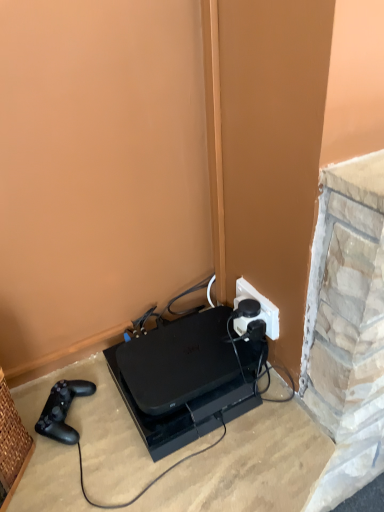
Question: From a real-world perspective, does white plastic power plugs and sockets at center-right sit lower than black matte game controller at lower left?

Choices:
 (A) yes
 (B) no

Answer: (B)

Question: From a real-world perspective, is white plastic power plugs and sockets at center-right physically above black matte game controller at lower left?

Choices:
 (A) yes
 (B) no

Answer: (A)

Question: Does white plastic power plugs and sockets at center-right appear on the right side of black matte game controller at lower left?

Choices:
 (A) no
 (B) yes

Answer: (B)

Question: Does white plastic power plugs and sockets at center-right turn towards black matte game controller at lower left?

Choices:
 (A) yes
 (B) no

Answer: (A)

Question: Is white plastic power plugs and sockets at center-right oriented away from black matte game controller at lower left?

Choices:
 (A) yes
 (B) no

Answer: (B)

Question: Is white plastic power plugs and sockets at center-right touching black matte game controller at lower left?

Choices:
 (A) yes
 (B) no

Answer: (B)

Question: Does black matte game controller at lower left lie in front of white plastic power plugs and sockets at center-right?

Choices:
 (A) yes
 (B) no

Answer: (A)

Question: Is black matte game controller at lower left to the right of white plastic power plugs and sockets at center-right from the viewer's perspective?

Choices:
 (A) yes
 (B) no

Answer: (B)

Question: Does black matte game controller at lower left lie behind white plastic power plugs and sockets at center-right?

Choices:
 (A) no
 (B) yes

Answer: (A)

Question: Can you confirm if black matte game controller at lower left is smaller than white plastic power plugs and sockets at center-right?

Choices:
 (A) no
 (B) yes

Answer: (A)

Question: Is black matte game controller at lower left completely or partially outside of white plastic power plugs and sockets at center-right?

Choices:
 (A) no
 (B) yes

Answer: (B)

Question: Considering the relative sizes of black matte game controller at lower left and white plastic power plugs and sockets at center-right in the image provided, is black matte game controller at lower left thinner than white plastic power plugs and sockets at center-right?

Choices:
 (A) no
 (B) yes

Answer: (A)

Question: From the image's perspective, is black plastic gaming console at lower center below white plastic power plugs and sockets at center-right?

Choices:
 (A) no
 (B) yes

Answer: (B)